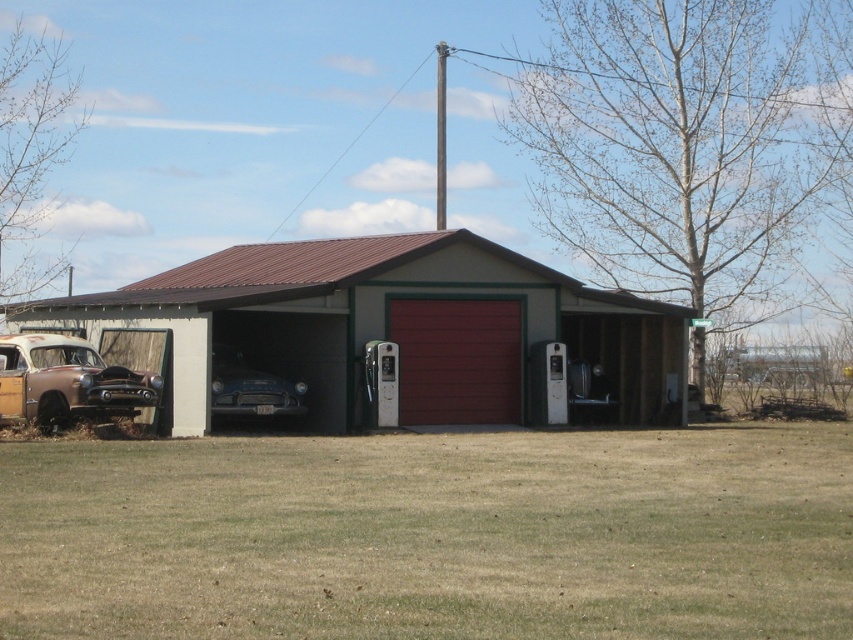
Based on the photo, who is higher up, matte red garage door at center or shiny blue car at center?

matte red garage door at center

Does matte red garage door at center come in front of shiny blue car at center?

That is False.

Between point (419, 403) and point (250, 385), which one is positioned in front?

Positioned in front is point (250, 385).

I want to click on matte red garage door at center, so click(x=457, y=358).

Who is taller, matte red garage door at center or rustic wood pickup truck at left?

matte red garage door at center

Is point (503, 321) closer to camera compared to point (36, 406)?

That is False.

Is point (502, 346) positioned behind point (45, 348)?

Yes, point (502, 346) is behind point (45, 348).

The image size is (853, 640). I want to click on matte red garage door at center, so click(457, 358).

Between point (393, 244) and point (224, 387), which one is positioned behind?

The point (393, 244) is behind.

Which is more to the left, metallic red garage door at center or shiny blue car at center?

Positioned to the left is shiny blue car at center.

Image resolution: width=853 pixels, height=640 pixels. I want to click on metallic red garage door at center, so click(x=386, y=326).